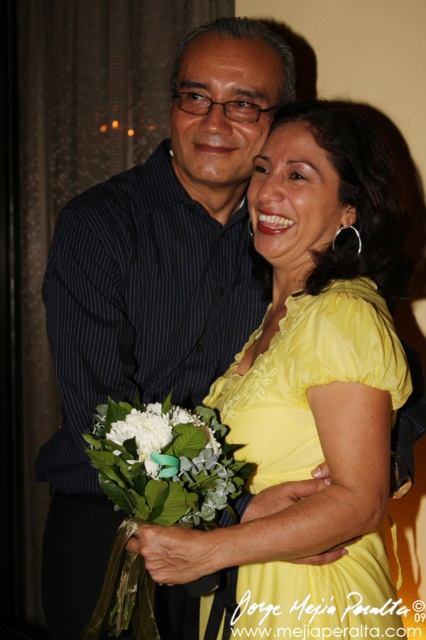
Looking at this image, how much distance is there between yellow satin dress at center and white fabric bouquet at center?

The distance of yellow satin dress at center from white fabric bouquet at center is 6.83 inches.

Does point (313, 342) come closer to viewer compared to point (244, 461)?

Yes, point (313, 342) is in front of point (244, 461).

The height and width of the screenshot is (640, 426). Identify the location of yellow satin dress at center. (307, 376).

Does white fabric bouquet at center have a lesser width compared to white matte flower at center?

Incorrect, white fabric bouquet at center's width is not less than white matte flower at center's.

Does white fabric bouquet at center have a lesser height compared to white matte flower at center?

In fact, white fabric bouquet at center may be taller than white matte flower at center.

Who is more forward, (175, 522) or (213, 432)?

Point (175, 522) is in front.

Where is `white fabric bouquet at center`? The width and height of the screenshot is (426, 640). white fabric bouquet at center is located at coordinates (155, 492).

Is yellow satin dress at center thinner than white matte flower at center?

In fact, yellow satin dress at center might be wider than white matte flower at center.

Is yellow satin dress at center wider than white matte flower at center?

Yes.

Is point (393, 632) more distant than point (141, 422)?

Yes.

Where is `yellow satin dress at center`? yellow satin dress at center is located at coordinates (307, 376).